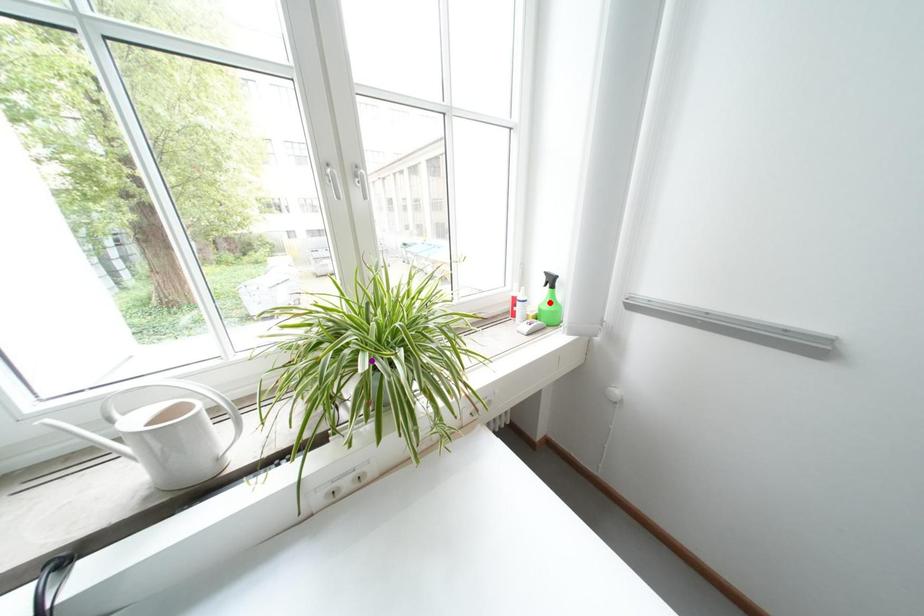
Order these from nearest to farthest:
- red point
- orange point
- purple point

1. red point
2. orange point
3. purple point